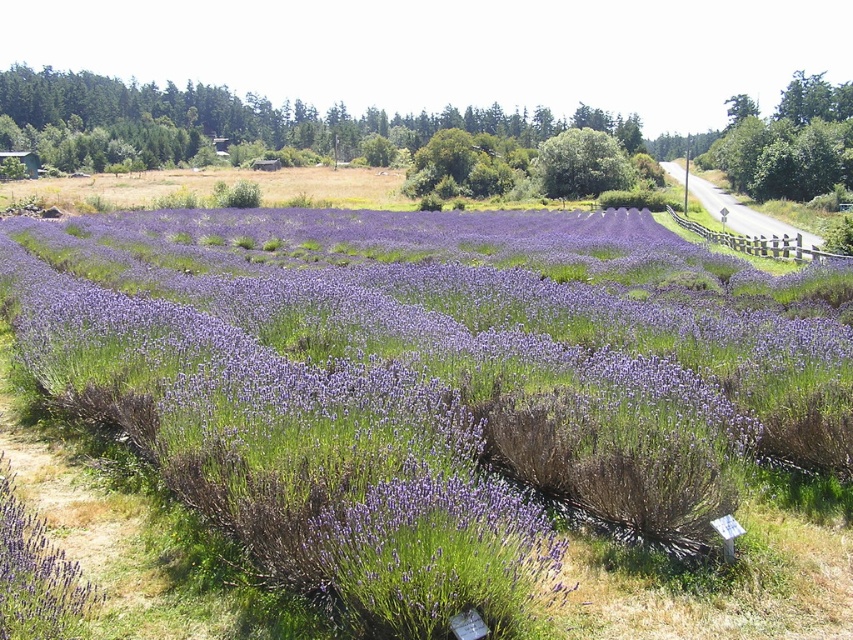
Who is higher up, purple soft-textured lavender at center or purple matte lavender at lower left?

purple soft-textured lavender at center is higher up.

Does purple soft-textured lavender at center have a greater height compared to purple matte lavender at lower left?

Yes.

Who is more forward, (277, 445) or (6, 577)?

Point (6, 577)

Identify the location of purple soft-textured lavender at center. (433, 378).